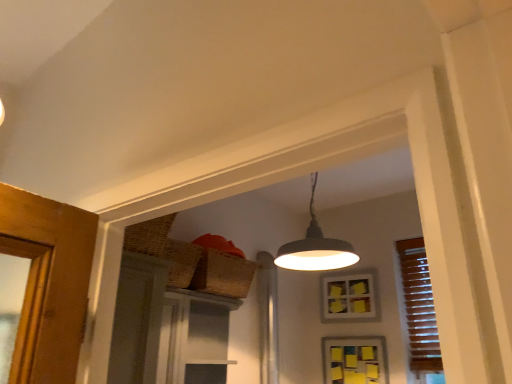
In order to face yellow sticky notes at center, acting as the first window starting from the top, should I rotate leftwards or rightwards?

To face it directly, rotate right by 12.287 degrees.

Based on the photo, measure the distance between point [358,319] and camera.

The depth of point [358,319] is 2.89 meters.

This screenshot has height=384, width=512. What do you see at coordinates (194, 338) in the screenshot?
I see `matte gray screen door at center` at bounding box center [194, 338].

At what (x,y) coordinates should I click in order to perform the action: click on yellow paper at upper center, the 1th window in the bottom-to-top sequence. Please return your answer as a coordinate pair (x, y). The image size is (512, 384). Looking at the image, I should click on (355, 360).

Which is in front, point (362, 313) or point (385, 359)?

The point (385, 359) is in front.

Where is `window in front of the yellow sticky notes at center, which is the 2th window in bottom-to-top order`? This screenshot has width=512, height=384. window in front of the yellow sticky notes at center, which is the 2th window in bottom-to-top order is located at coordinates (355, 360).

Is yellow sticky notes at center, which is the 2th window in bottom-to-top order, wider or thinner than yellow paper at upper center, the 1th window in the bottom-to-top sequence?

Considering their sizes, yellow sticky notes at center, which is the 2th window in bottom-to-top order, looks broader than yellow paper at upper center, the 1th window in the bottom-to-top sequence.

How many degrees apart are the facing directions of yellow sticky notes at center, acting as the first window starting from the top, and yellow paper at upper center, which is the second window in top-to-bottom order?

The angular difference between yellow sticky notes at center, acting as the first window starting from the top, and yellow paper at upper center, which is the second window in top-to-bottom order, is 0.567 degrees.

Is yellow paper at upper center, which is the second window in top-to-bottom order, shorter than matte gray lampshade at upper center?

Yes, yellow paper at upper center, which is the second window in top-to-bottom order, is shorter than matte gray lampshade at upper center.

Is yellow paper at upper center, the 1th window in the bottom-to-top sequence, positioned with its back to matte gray lampshade at upper center?

yellow paper at upper center, the 1th window in the bottom-to-top sequence, does not have its back to matte gray lampshade at upper center.

Is yellow paper at upper center, which is the second window in top-to-bottom order, positioned far away from matte gray lampshade at upper center?

Actually, yellow paper at upper center, which is the second window in top-to-bottom order, and matte gray lampshade at upper center are a little close together.

Can you confirm if yellow paper at upper center, the 1th window in the bottom-to-top sequence, is smaller than matte gray lampshade at upper center?

Correct, yellow paper at upper center, the 1th window in the bottom-to-top sequence, occupies less space than matte gray lampshade at upper center.

From a real-world perspective, between yellow paper at upper center, the 1th window in the bottom-to-top sequence, and matte gray screen door at center, who is vertically lower?

In real-world perspective, yellow paper at upper center, the 1th window in the bottom-to-top sequence, is lower.

Which window is the 1st one when counting from the right side of the matte gray screen door at center? Please provide its 2D coordinates.

[(355, 360)]

Who is bigger, yellow paper at upper center, which is the second window in top-to-bottom order, or matte gray screen door at center?

With larger size is matte gray screen door at center.

How different are the orientations of yellow paper at upper center, which is the second window in top-to-bottom order, and matte gray screen door at center in degrees?

The angular difference between yellow paper at upper center, which is the second window in top-to-bottom order, and matte gray screen door at center is 89.7 degrees.

Is yellow sticky notes at center, which is the 2th window in bottom-to-top order, at the back of yellow paper at upper center, the 1th window in the bottom-to-top sequence?

No, yellow paper at upper center, the 1th window in the bottom-to-top sequence,'s orientation is not away from yellow sticky notes at center, which is the 2th window in bottom-to-top order.

Is yellow paper at upper center, the 1th window in the bottom-to-top sequence, taller or shorter than yellow sticky notes at center, which is the 2th window in bottom-to-top order?

Clearly, yellow paper at upper center, the 1th window in the bottom-to-top sequence, is shorter compared to yellow sticky notes at center, which is the 2th window in bottom-to-top order.

From the image's perspective, is yellow paper at upper center, which is the second window in top-to-bottom order, under yellow sticky notes at center, acting as the first window starting from the top?

Correct, yellow paper at upper center, which is the second window in top-to-bottom order, appears lower than yellow sticky notes at center, acting as the first window starting from the top, in the image.

Between yellow paper at upper center, which is the second window in top-to-bottom order, and yellow sticky notes at center, which is the 2th window in bottom-to-top order, which one has smaller size?

Smaller between the two is yellow paper at upper center, which is the second window in top-to-bottom order.

Are yellow sticky notes at center, acting as the first window starting from the top, and matte gray lampshade at upper center far apart?

yellow sticky notes at center, acting as the first window starting from the top, is actually quite close to matte gray lampshade at upper center.

Considering the positions of point (325, 310) and point (314, 229), is point (325, 310) closer or farther from the camera than point (314, 229)?

Point (325, 310).

What's the angular difference between yellow sticky notes at center, which is the 2th window in bottom-to-top order, and matte gray lampshade at upper center's facing directions?

yellow sticky notes at center, which is the 2th window in bottom-to-top order, and matte gray lampshade at upper center are facing 5.44 degrees away from each other.

Between yellow sticky notes at center, acting as the first window starting from the top, and matte gray lampshade at upper center, which one appears on the right side from the viewer's perspective?

yellow sticky notes at center, acting as the first window starting from the top.

Can you confirm if matte gray screen door at center is taller than yellow paper at upper center, which is the second window in top-to-bottom order?

Correct, matte gray screen door at center is much taller as yellow paper at upper center, which is the second window in top-to-bottom order.

Considering the sizes of matte gray screen door at center and yellow paper at upper center, the 1th window in the bottom-to-top sequence, in the image, is matte gray screen door at center wider or thinner than yellow paper at upper center, the 1th window in the bottom-to-top sequence,?

Considering their sizes, matte gray screen door at center looks broader than yellow paper at upper center, the 1th window in the bottom-to-top sequence.

Is matte gray screen door at center oriented away from yellow paper at upper center, the 1th window in the bottom-to-top sequence?

matte gray screen door at center does not have its back to yellow paper at upper center, the 1th window in the bottom-to-top sequence.

Considering the relative positions of matte gray lampshade at upper center and yellow sticky notes at center, acting as the first window starting from the top, in the image provided, is matte gray lampshade at upper center to the left of yellow sticky notes at center, acting as the first window starting from the top, from the viewer's perspective?

Yes.

How many degrees apart are the facing directions of matte gray lampshade at upper center and yellow sticky notes at center, acting as the first window starting from the top?

They differ by 5.44 degrees in their facing directions.

Is matte gray lampshade at upper center positioned before yellow sticky notes at center, which is the 2th window in bottom-to-top order?

Yes.

The image size is (512, 384). Identify the location of window that appears below the yellow sticky notes at center, acting as the first window starting from the top (from a real-world perspective). (355, 360).

In the image, there is a yellow paper at upper center, the 1th window in the bottom-to-top sequence. Where is `lamp above it (from the image's perspective)`? The image size is (512, 384). lamp above it (from the image's perspective) is located at coordinates (315, 247).

Estimate the real-world distances between objects in this image. Which object is further from yellow sticky notes at center, which is the 2th window in bottom-to-top order, yellow paper at upper center, the 1th window in the bottom-to-top sequence, or matte gray screen door at center?

matte gray screen door at center is positioned further to the anchor yellow sticky notes at center, which is the 2th window in bottom-to-top order.

Looking at the image, which one is located closer to yellow paper at upper center, which is the second window in top-to-bottom order, matte gray screen door at center or yellow sticky notes at center, which is the 2th window in bottom-to-top order?

Among the two, yellow sticky notes at center, which is the 2th window in bottom-to-top order, is located nearer to yellow paper at upper center, which is the second window in top-to-bottom order.

Which object lies further to the anchor point matte gray lampshade at upper center, yellow sticky notes at center, which is the 2th window in bottom-to-top order, or matte gray screen door at center?

yellow sticky notes at center, which is the 2th window in bottom-to-top order, is positioned further to the anchor matte gray lampshade at upper center.

Based on their spatial positions, is matte gray lampshade at upper center or yellow paper at upper center, which is the second window in top-to-bottom order, closer to yellow sticky notes at center, which is the 2th window in bottom-to-top order?

Based on the image, yellow paper at upper center, which is the second window in top-to-bottom order, appears to be nearer to yellow sticky notes at center, which is the 2th window in bottom-to-top order.

Looking at the image, which one is located further to matte gray lampshade at upper center, yellow paper at upper center, which is the second window in top-to-bottom order, or matte gray screen door at center?

Based on the image, yellow paper at upper center, which is the second window in top-to-bottom order, appears to be further to matte gray lampshade at upper center.

From the picture: When comparing their distances from yellow sticky notes at center, which is the 2th window in bottom-to-top order, does matte gray screen door at center or yellow paper at upper center, which is the second window in top-to-bottom order, seem further?

Based on the image, matte gray screen door at center appears to be further to yellow sticky notes at center, which is the 2th window in bottom-to-top order.

Looking at the image, which one is located closer to yellow paper at upper center, the 1th window in the bottom-to-top sequence, matte gray lampshade at upper center or matte gray screen door at center?

matte gray lampshade at upper center is positioned closer to the anchor yellow paper at upper center, the 1th window in the bottom-to-top sequence.

Looking at the image, which one is located further to yellow sticky notes at center, acting as the first window starting from the top, matte gray screen door at center or matte gray lampshade at upper center?

Based on the image, matte gray screen door at center appears to be further to yellow sticky notes at center, acting as the first window starting from the top.

Find the location of a particular element. This screenshot has width=512, height=384. screen door that lies between matte gray lampshade at upper center and yellow paper at upper center, the 1th window in the bottom-to-top sequence, from top to bottom is located at coordinates (194, 338).

Locate an element on the screen. window between matte gray screen door at center and yellow sticky notes at center, acting as the first window starting from the top, in the horizontal direction is located at coordinates (355, 360).

Where is `screen door between matte gray lampshade at upper center and yellow sticky notes at center, which is the 2th window in bottom-to-top order, from front to back`? Image resolution: width=512 pixels, height=384 pixels. screen door between matte gray lampshade at upper center and yellow sticky notes at center, which is the 2th window in bottom-to-top order, from front to back is located at coordinates (194, 338).

The image size is (512, 384). Identify the location of window between matte gray lampshade at upper center and yellow sticky notes at center, acting as the first window starting from the top, in the front-back direction. (355, 360).